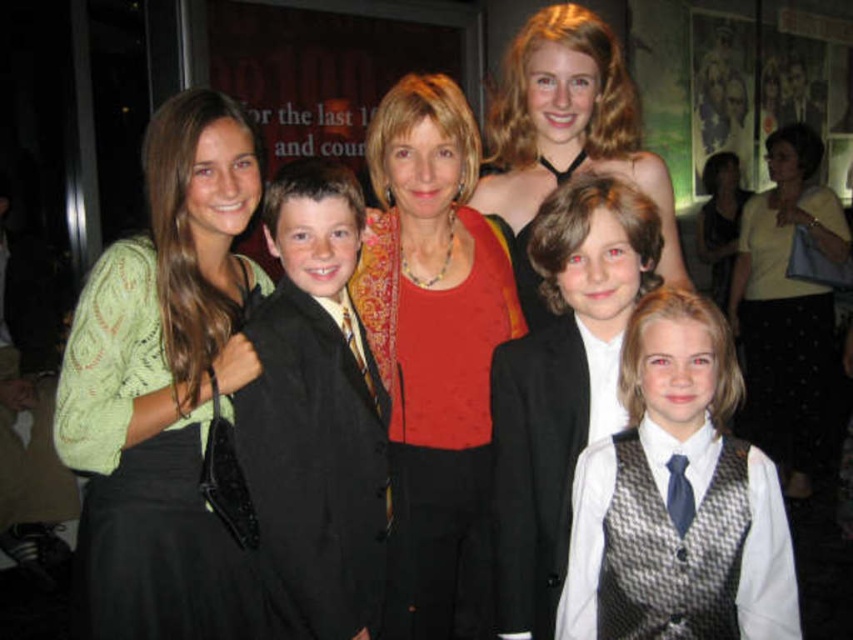
Does green textured sweater at left appear on the left side of yellow smooth shirt at right?

Yes, green textured sweater at left is to the left of yellow smooth shirt at right.

Between green textured sweater at left and yellow smooth shirt at right, which one has more height?

Standing taller between the two is yellow smooth shirt at right.

Which is in front, point (201, 346) or point (763, 220)?

Point (201, 346)

I want to click on green textured sweater at left, so click(164, 385).

Is silver textured vest at center taller than white shirt with patterned vest at center?

No, silver textured vest at center is not taller than white shirt with patterned vest at center.

Does point (712, 433) come closer to viewer compared to point (553, 593)?

Yes, point (712, 433) is closer to viewer.

Where is `silver textured vest at center`? This screenshot has width=853, height=640. silver textured vest at center is located at coordinates (682, 493).

Is matte black dress at center taller than yellow smooth shirt at right?

No.

Locate an element on the screen. The height and width of the screenshot is (640, 853). matte black dress at center is located at coordinates (566, 132).

Locate an element on the screen. This screenshot has height=640, width=853. matte black dress at center is located at coordinates (566, 132).